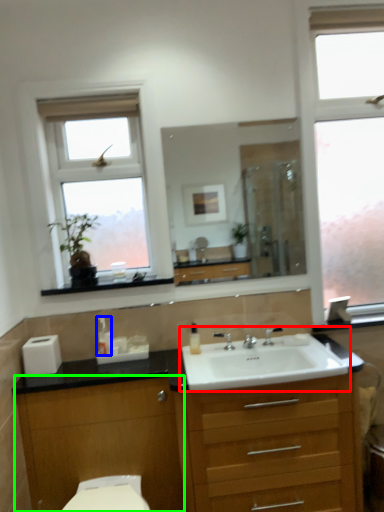
Question: Which object is the closest to the sink (highlighted by a red box)? Choose among these: soap dispenser (highlighted by a blue box) or cabinetry (highlighted by a green box).

Choices:
 (A) soap dispenser
 (B) cabinetry

Answer: (B)